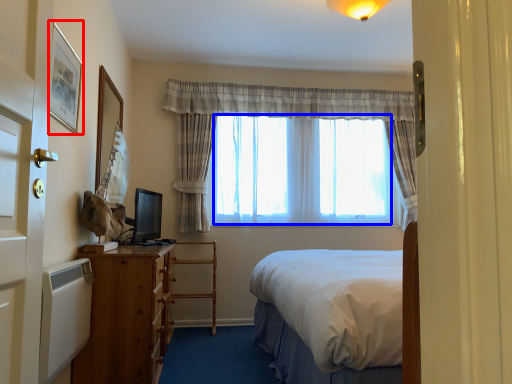
Question: Which object is further to the camera taking this photo, picture frame (highlighted by a red box) or window screen (highlighted by a blue box)?

Choices:
 (A) picture frame
 (B) window screen

Answer: (B)